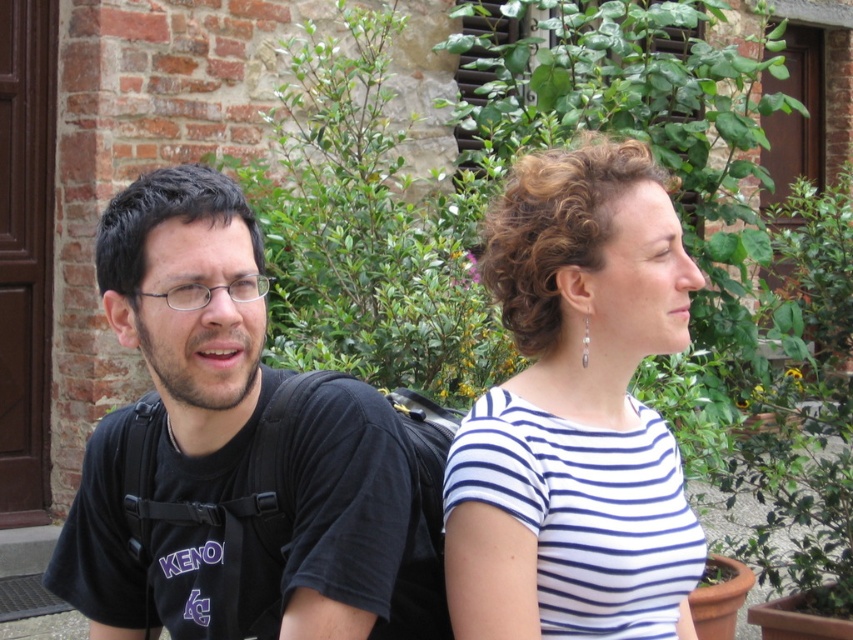
Question: From the image, what is the correct spatial relationship of white striped shirt at center in relation to black matte t-shirt at left?

Choices:
 (A) left
 (B) right

Answer: (B)

Question: In this image, where is white striped shirt at center located relative to black matte t-shirt at left?

Choices:
 (A) left
 (B) right

Answer: (B)

Question: Is white striped shirt at center further to the viewer compared to black matte t-shirt at left?

Choices:
 (A) yes
 (B) no

Answer: (A)

Question: Which point is closer to the camera?

Choices:
 (A) black matte t-shirt at left
 (B) white striped shirt at center

Answer: (A)

Question: Which point is farther to the camera?

Choices:
 (A) (332, 468)
 (B) (595, 193)

Answer: (B)

Question: Which point appears farthest from the camera in this image?

Choices:
 (A) (79, 548)
 (B) (648, 497)

Answer: (A)